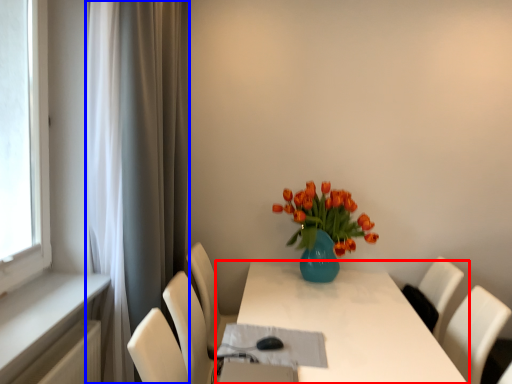
Question: Which object is closer to the camera taking this photo, table (highlighted by a red box) or curtain (highlighted by a blue box)?

Choices:
 (A) table
 (B) curtain

Answer: (A)